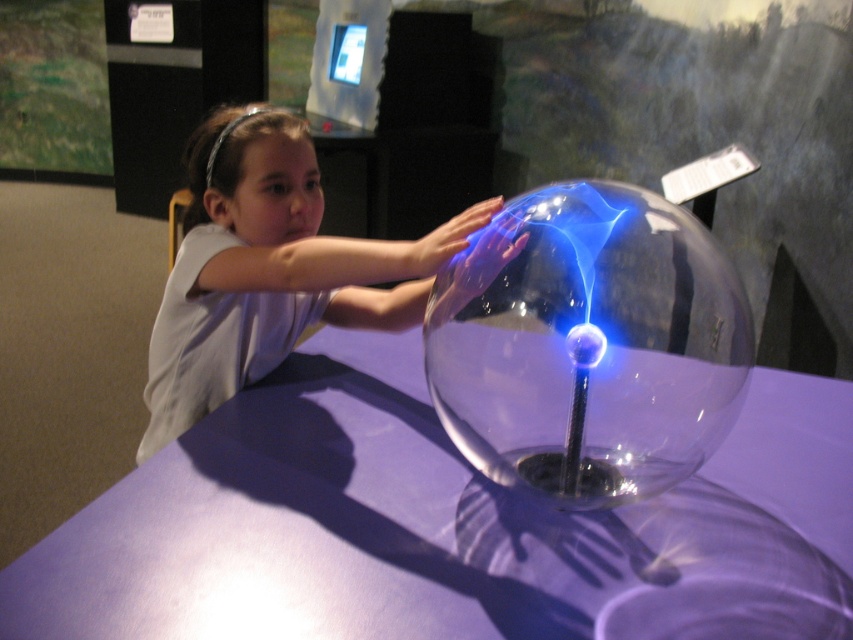
Question: Which point is closer to the camera?

Choices:
 (A) white glossy shirt at upper center
 (B) transparent glass sphere at center

Answer: (B)

Question: Which object is the farthest from the purple glass table at center?

Choices:
 (A) white glossy shirt at upper center
 (B) transparent glass sphere at center

Answer: (B)

Question: Does purple glass table at center have a larger size compared to white glossy shirt at upper center?

Choices:
 (A) yes
 (B) no

Answer: (A)

Question: Among these points, which one is farthest from the camera?

Choices:
 (A) (212, 180)
 (B) (613, 321)

Answer: (B)

Question: Is transparent glass sphere at center positioned behind white glossy shirt at upper center?

Choices:
 (A) no
 (B) yes

Answer: (A)

Question: Where is purple glass table at center located in relation to white glossy shirt at upper center in the image?

Choices:
 (A) right
 (B) left

Answer: (A)